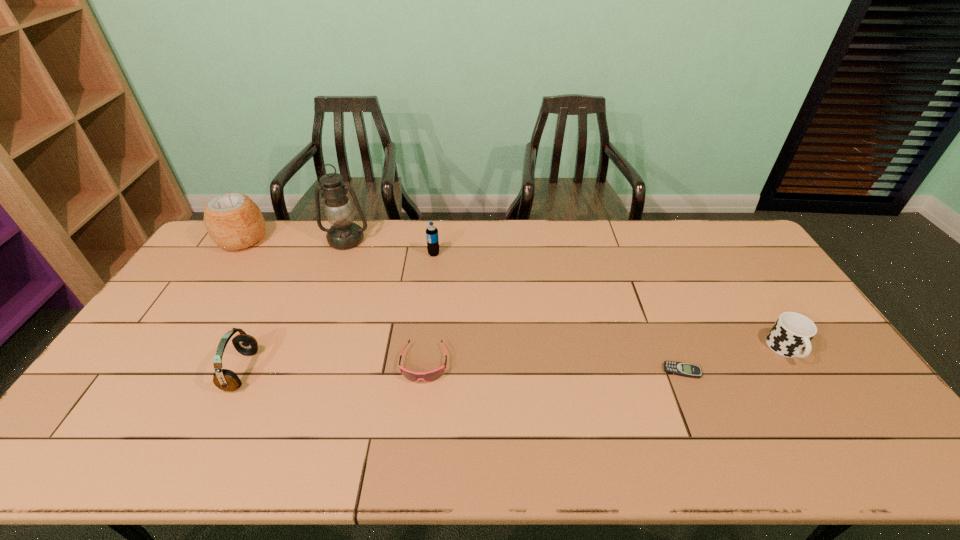
The image size is (960, 540). I want to click on the tallest object, so [x=343, y=234].

The width and height of the screenshot is (960, 540). I want to click on the fifth object from right to left, so click(343, 234).

This screenshot has width=960, height=540. I want to click on coconut, so click(233, 221).

Identify the location of the leftmost object. The height and width of the screenshot is (540, 960). (233, 221).

Where is `soda bottle`? soda bottle is located at coordinates (432, 238).

Find the location of a particular element. the second object from left to right is located at coordinates (225, 379).

Where is `the third shortest object`? This screenshot has height=540, width=960. the third shortest object is located at coordinates (791, 334).

This screenshot has width=960, height=540. In order to click on cup in this screenshot , I will do `click(791, 334)`.

Find the location of `the sixth tallest object`. the sixth tallest object is located at coordinates (433, 375).

What are the coordinates of `beeper` in the screenshot? It's located at (677, 368).